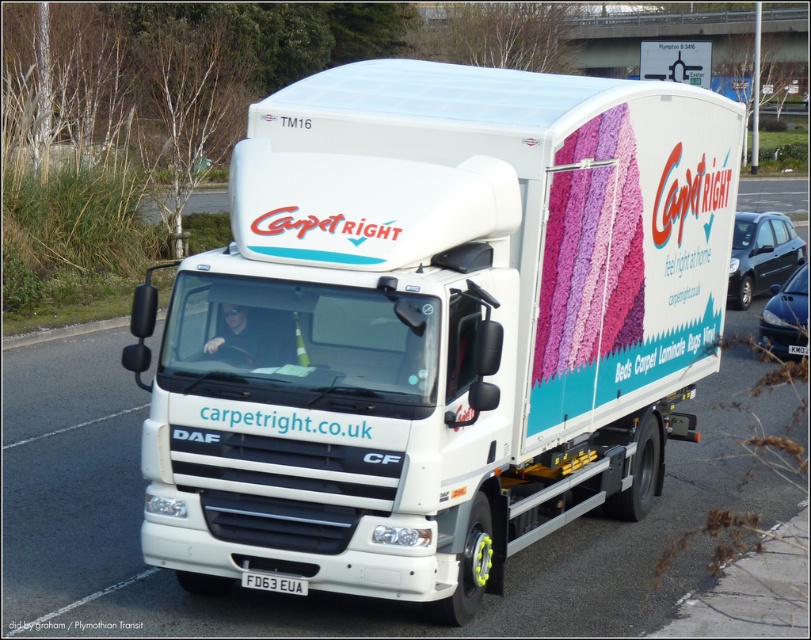
You are a delivery driver who needs to pass under a low bridge that has a height restriction of 4 meters. The white matte trailer truck at center and the white plastic license plate at center are part of the truck. Based on their height relationship, can you estimate if the truck will fit under the bridge?

The white matte trailer truck at center is taller than the white plastic license plate at center. Since the license plate is typically mounted below the truck cab, the overall height of the truck is likely above the license plate. However, without specific measurements, it is impossible to confirm if the truck will fit under a 4 meter bridge. Check the truck manufacturer specifications or physically measure the truck height before proceeding.

You are a pedestrian standing at the roundabout where the white matte trailer truck at center and metallic blue sedan at right are passing by. Which vehicle do you see first as they approach the roundabout?

You will see the white matte trailer truck at center first because it is closer to you than the metallic blue sedan at right.